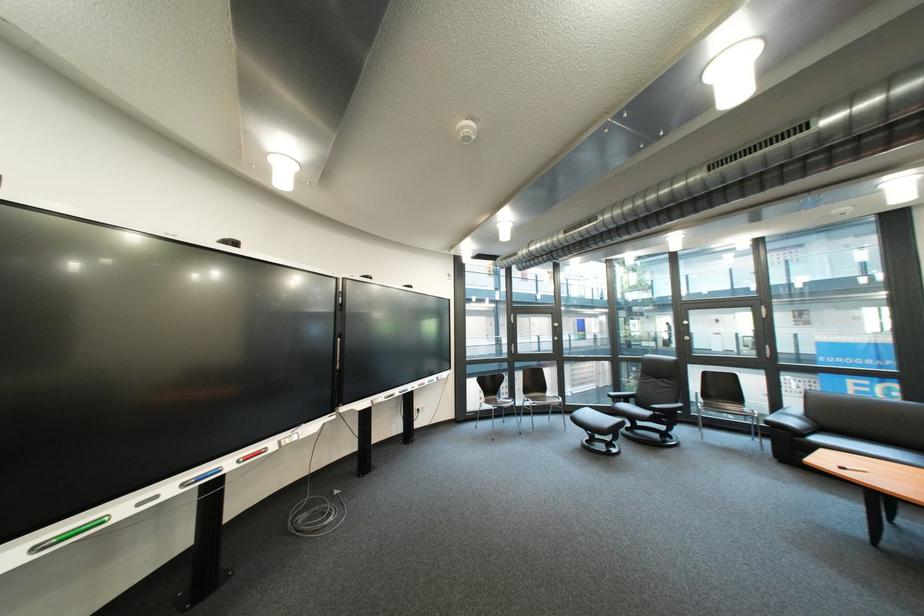
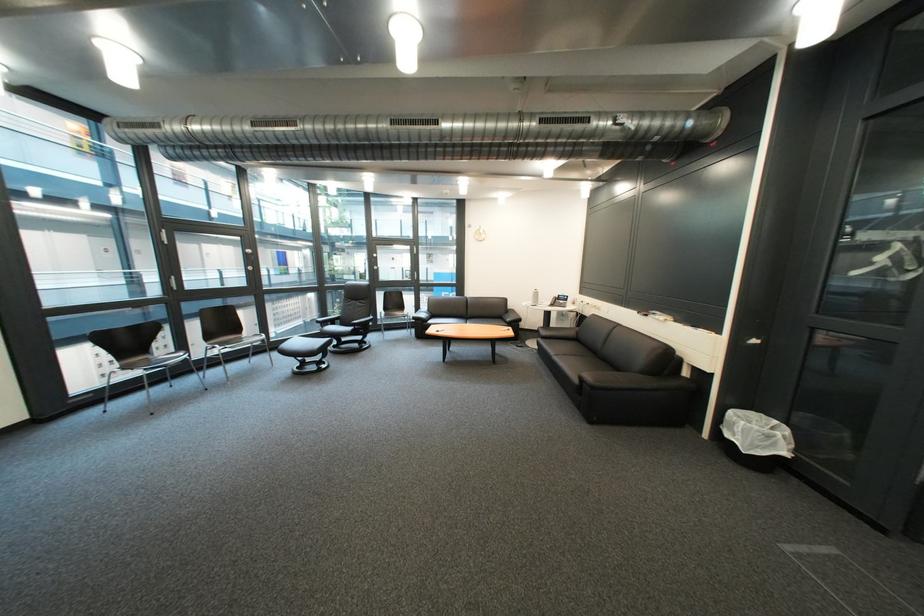
In the second image, find the point that corresponds to (x=524, y=326) in the first image.

(176, 249)